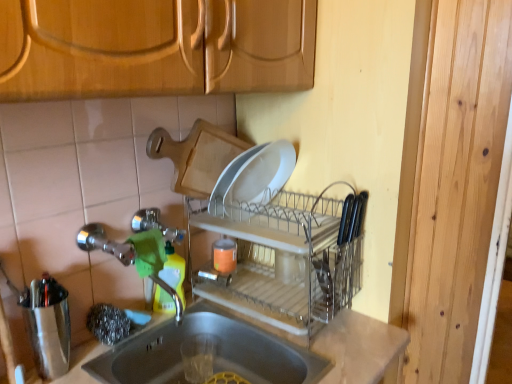
Question: From the image's perspective, does clear plastic dish rack at center appear higher than green plastic bottle at sink?

Choices:
 (A) no
 (B) yes

Answer: (B)

Question: Considering the relative positions of clear plastic dish rack at center and green plastic bottle at sink in the image provided, is clear plastic dish rack at center behind green plastic bottle at sink?

Choices:
 (A) yes
 (B) no

Answer: (B)

Question: Is clear plastic dish rack at center far from green plastic bottle at sink?

Choices:
 (A) yes
 (B) no

Answer: (B)

Question: Is clear plastic dish rack at center placed right next to green plastic bottle at sink?

Choices:
 (A) yes
 (B) no

Answer: (B)

Question: From a real-world perspective, is clear plastic dish rack at center located beneath green plastic bottle at sink?

Choices:
 (A) yes
 (B) no

Answer: (B)

Question: Is clear plastic dish rack at center positioned with its back to green plastic bottle at sink?

Choices:
 (A) yes
 (B) no

Answer: (B)

Question: Is clear plastic dish rack at center next to brushed metal shaker at left and touching it?

Choices:
 (A) yes
 (B) no

Answer: (B)

Question: Is clear plastic dish rack at center further to the viewer compared to brushed metal shaker at left?

Choices:
 (A) no
 (B) yes

Answer: (B)

Question: Is clear plastic dish rack at center closer to the viewer compared to brushed metal shaker at left?

Choices:
 (A) no
 (B) yes

Answer: (A)

Question: Is clear plastic dish rack at center not within brushed metal shaker at left?

Choices:
 (A) no
 (B) yes

Answer: (B)

Question: From a real-world perspective, is clear plastic dish rack at center located beneath brushed metal shaker at left?

Choices:
 (A) yes
 (B) no

Answer: (B)

Question: From a real-world perspective, is clear plastic dish rack at center physically above brushed metal shaker at left?

Choices:
 (A) no
 (B) yes

Answer: (B)

Question: Is green plastic bottle at sink at the left side of brushed metal shaker at left?

Choices:
 (A) yes
 (B) no

Answer: (B)